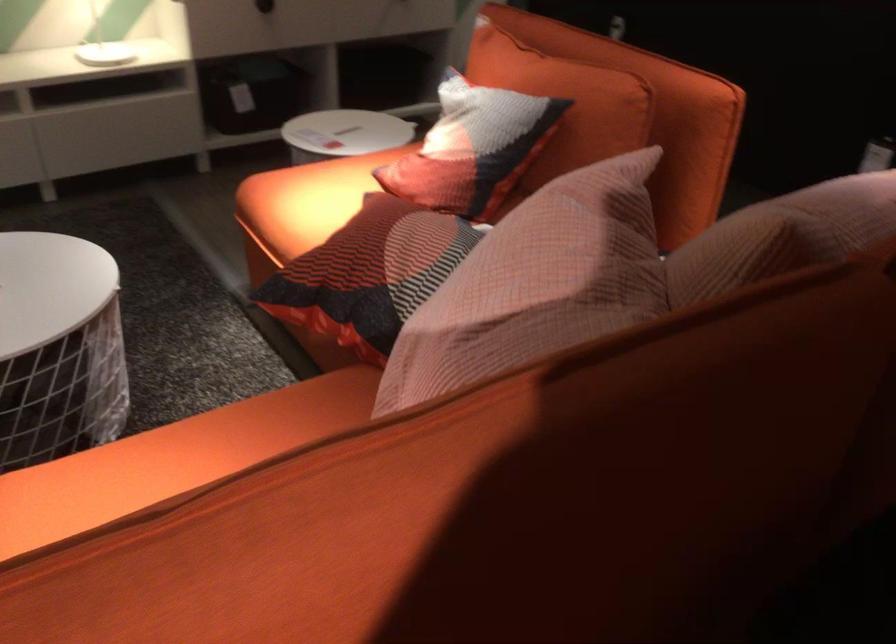
Find where to pull the black drawer knob. Please return your answer as a coordinate pair (x, y).

(264, 6)